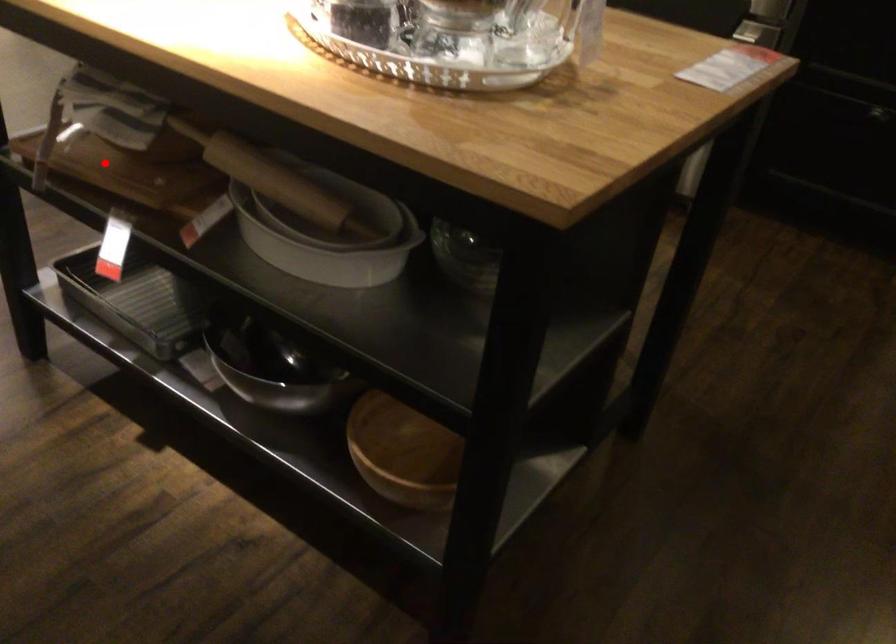
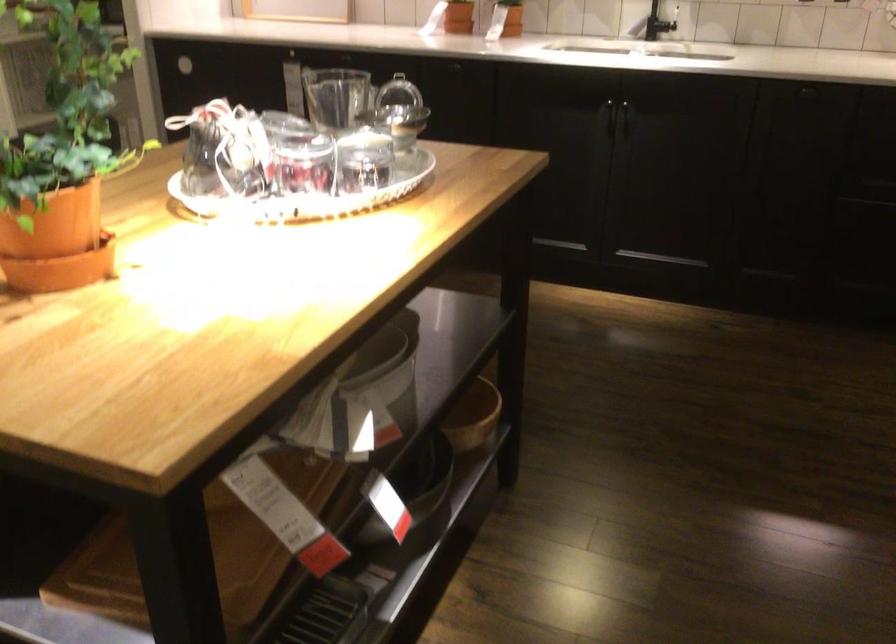
Question: A red point is marked in image1. In image2, is the corresponding 3D point closer to the camera or farther? Reply with the corresponding letter.

Choices:
 (A) The corresponding 3D point is closer.
 (B) The corresponding 3D point is farther.

Answer: (A)